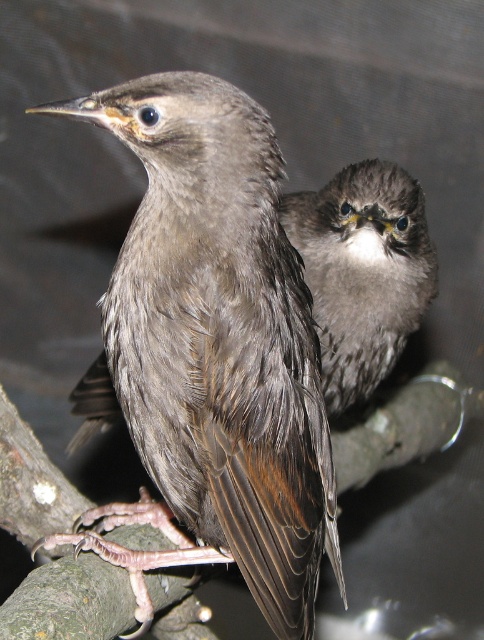
You are a birdwatcher trying to identify two birds in the image. The birds are labeled as the brown feathered bird at center and the dark gray feathers at center. Based on their positions and sizes, which bird do you think is more likely to be the foreground bird?

The brown feathered bird at center is more likely to be the foreground bird because it is wider than the dark gray feathers at center, which is a common characteristic of objects closer to the viewer.

Consider the image. You are a birdwatcher trying to identify two birds in the image. The dark gray feathers at center and the fuzzy gray bird at upper right. Which one is closer to you?

The dark gray feathers at center is closer to you than the fuzzy gray bird at upper right because it is further to the viewer.